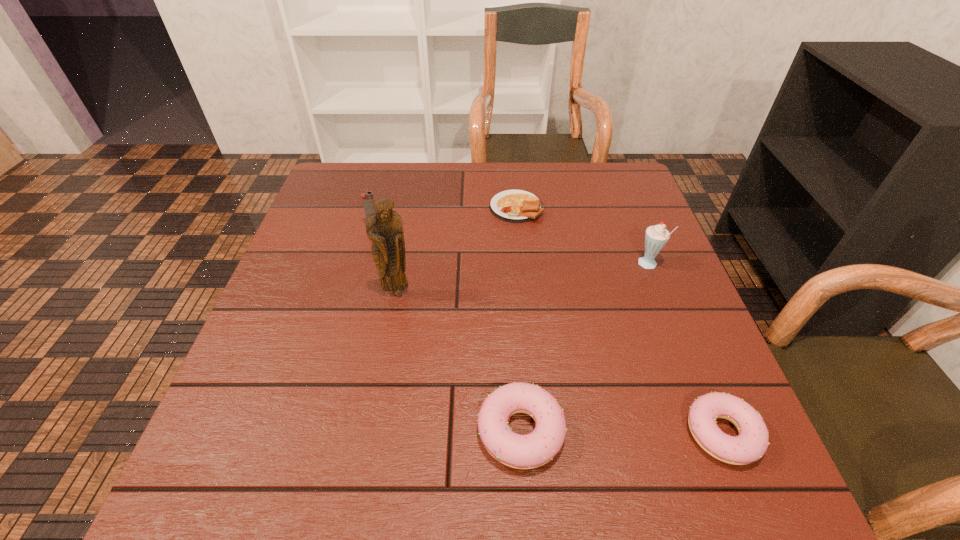
Where is `object that ranks as the fifth closest to the figurine`? object that ranks as the fifth closest to the figurine is located at coordinates (750, 445).

You are a GUI agent. You are given a task and a screenshot of the screen. Output one action in this format:
    pyautogui.click(x=<x>, y=<y>)
    Task: Click on the object that stands as the fifth closest to the shortest object
    Image resolution: width=960 pixels, height=540 pixels.
    Given the screenshot: What is the action you would take?
    pyautogui.click(x=750, y=445)

Find the location of `free location that satisfies the following two spatial constraints: 1. on the front-facing side of the figurine; 2. on the left side of the taller doughnut`. free location that satisfies the following two spatial constraints: 1. on the front-facing side of the figurine; 2. on the left side of the taller doughnut is located at coordinates (372, 431).

The height and width of the screenshot is (540, 960). I want to click on vacant space that satisfies the following two spatial constraints: 1. on the back side of the taller doughnut; 2. on the left side of the omelet, so click(505, 207).

Where is `free space that satisfies the following two spatial constraints: 1. on the straw side of the milkshake; 2. on the right side of the second shortest object`? Image resolution: width=960 pixels, height=540 pixels. free space that satisfies the following two spatial constraints: 1. on the straw side of the milkshake; 2. on the right side of the second shortest object is located at coordinates (714, 433).

The width and height of the screenshot is (960, 540). In order to click on vacant space that satisfies the following two spatial constraints: 1. on the straw side of the fifth shortest object; 2. on the left side of the second shortest object in this screenshot , I will do pyautogui.click(x=714, y=433).

The image size is (960, 540). Identify the location of vacant area that satisfies the following two spatial constraints: 1. on the front-facing side of the right doughnut; 2. on the right side of the second object from left to right. (372, 433).

The image size is (960, 540). In order to click on free location that satisfies the following two spatial constraints: 1. on the front-facing side of the shorter doughnut; 2. on the right side of the second object from left to right in this screenshot , I will do `click(372, 433)`.